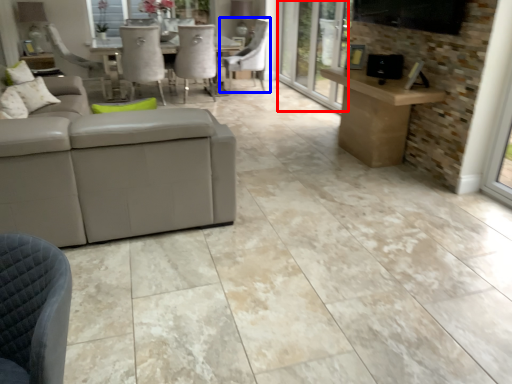
Question: Which point is closer to the camera, screen door (highlighted by a red box) or chair (highlighted by a blue box)?

Choices:
 (A) screen door
 (B) chair

Answer: (A)